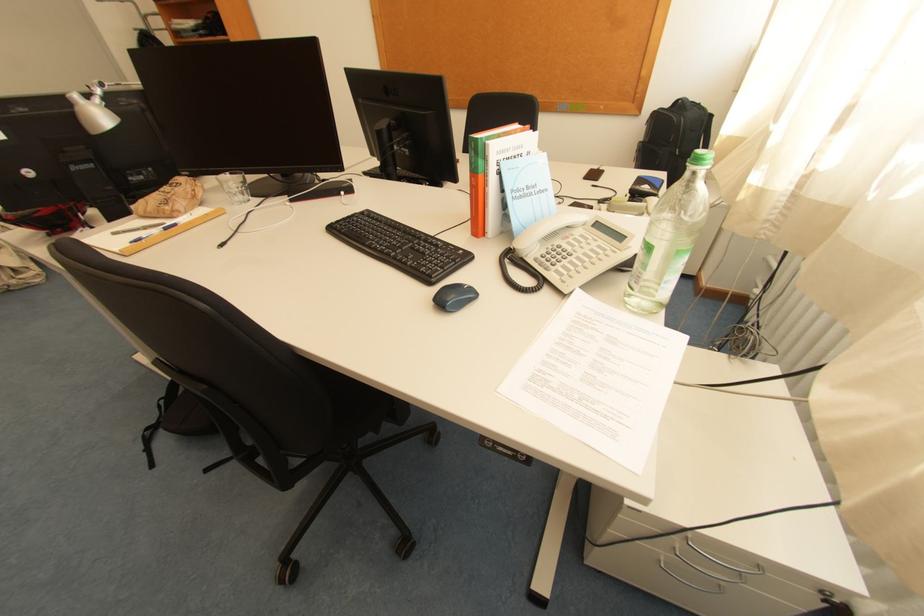
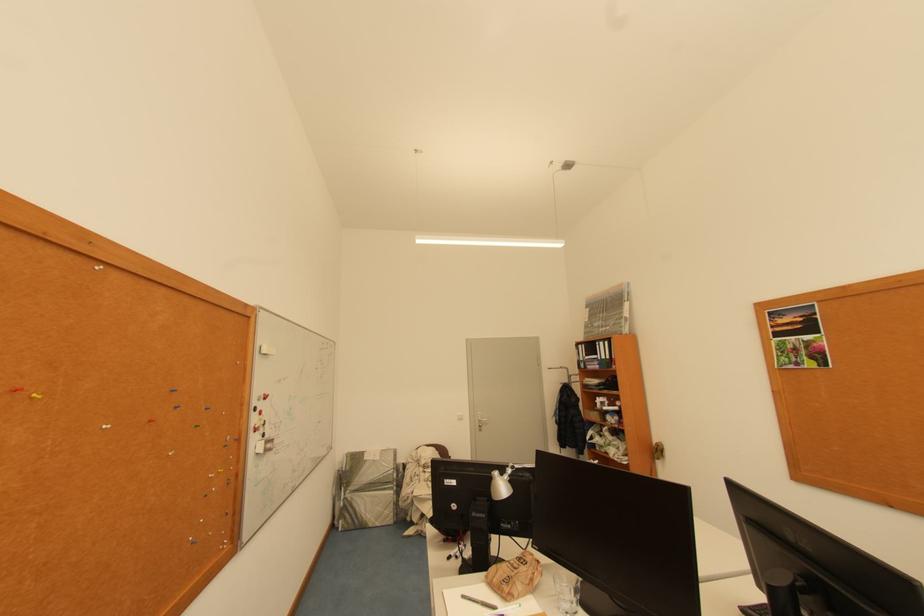
The first image is from the beginning of the video and the second image is from the end. How did the camera likely rotate when shooting the video?

The camera's rotation is toward left-up.